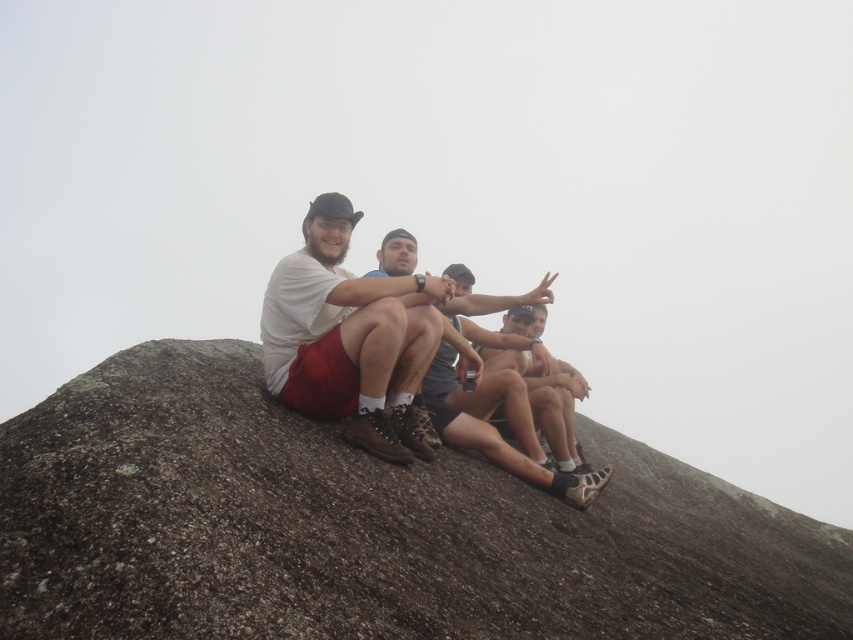
You are a drone operator trying to capture a photo of the group on the brown rough rock at center. The drone is currently at point 0.7, 0.4. Which direction should you move the drone to get closer to the rock?

The brown rough rock at center is located at point (367, 528). Since the drone is at (340, 448), you should move it northeast to reach the rock.